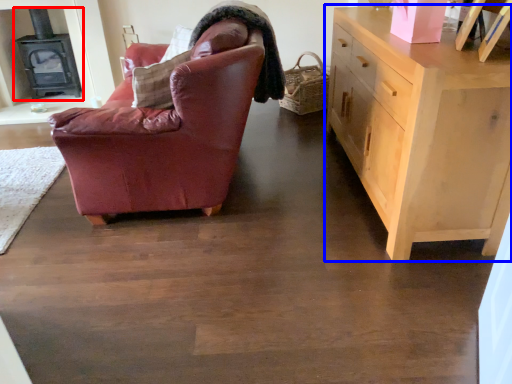
Question: Which point is closer to the camera, fireplace (highlighted by a red box) or chest of drawers (highlighted by a blue box)?

Choices:
 (A) fireplace
 (B) chest of drawers

Answer: (B)